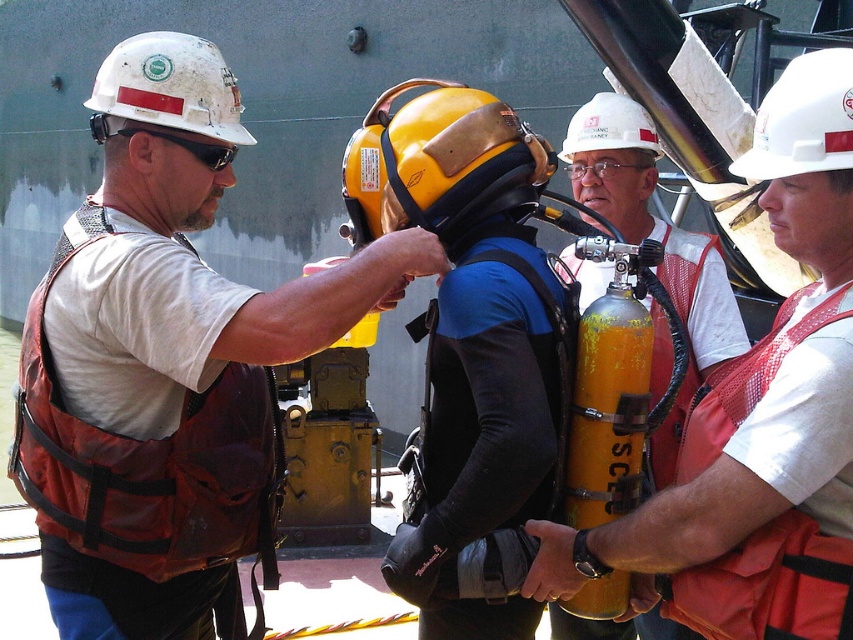
Can you confirm if matte yellow diving helmet at center is positioned to the right of orange mesh safety vest at right?

Incorrect, matte yellow diving helmet at center is not on the right side of orange mesh safety vest at right.

Between matte yellow diving helmet at center and orange mesh safety vest at right, which one has less height?

orange mesh safety vest at right is shorter.

Is point (425, 182) more distant than point (769, 340)?

Yes.

Find the location of `matte yellow diving helmet at center`. matte yellow diving helmet at center is located at coordinates (469, 349).

Describe the element at coordinates (656, 240) in the screenshot. The height and width of the screenshot is (640, 853). I see `matte orange cylinder at center` at that location.

Does matte orange cylinder at center appear on the left side of orange mesh safety vest at right?

Correct, you'll find matte orange cylinder at center to the left of orange mesh safety vest at right.

Is point (695, 280) more distant than point (801, 636)?

Yes, it is behind point (801, 636).

The height and width of the screenshot is (640, 853). In order to click on matte orange cylinder at center in this screenshot , I will do `click(656, 240)`.

Which is behind, point (94, 81) or point (781, 108)?

The point (94, 81) is more distant.

Is white matte hard hat at upper left further to the viewer compared to white matte helmet at upper right?

Yes, it is.

Describe the element at coordinates (169, 86) in the screenshot. The height and width of the screenshot is (640, 853). I see `white matte hard hat at upper left` at that location.

This screenshot has width=853, height=640. Find the location of `white matte hard hat at upper left`. white matte hard hat at upper left is located at coordinates (169, 86).